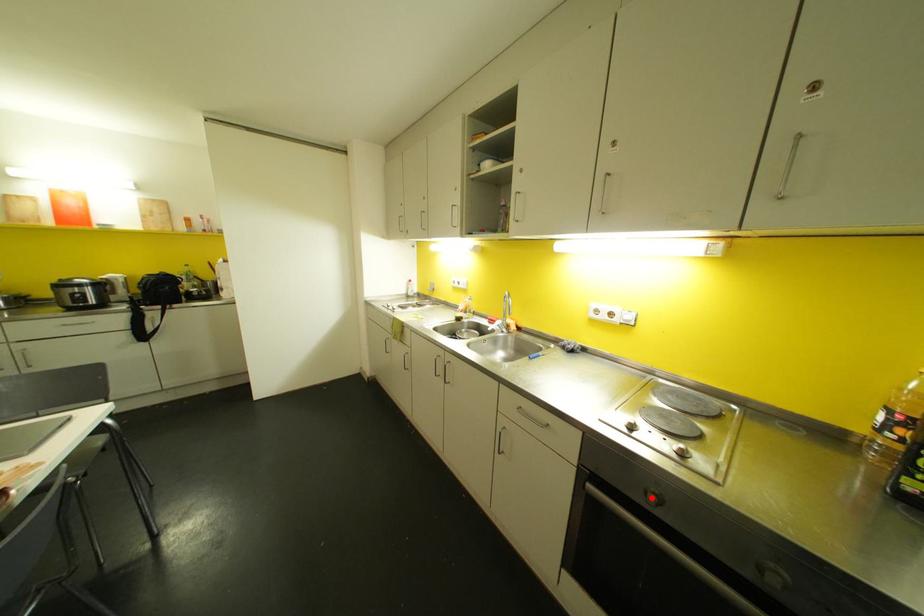
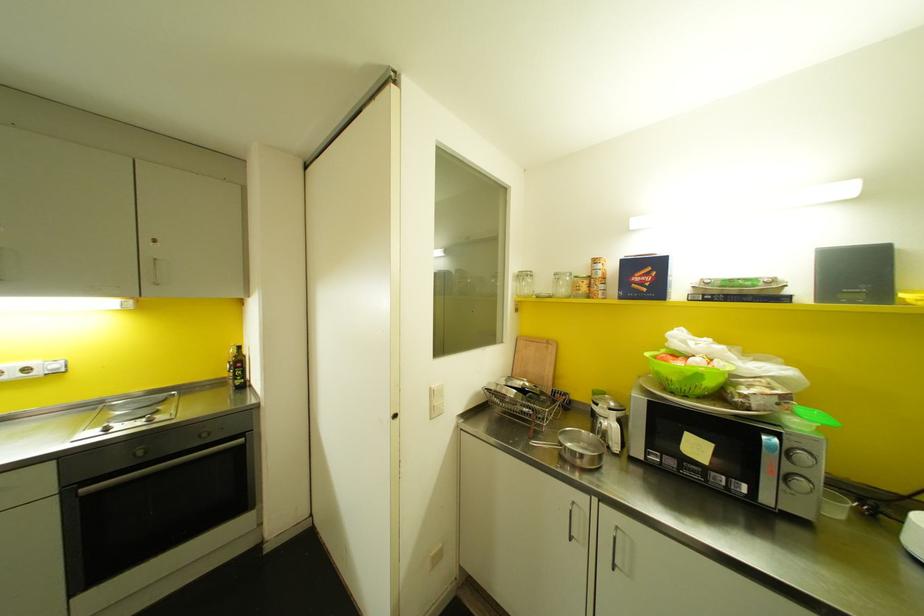
The point at the highlighted location is marked in the first image. Where is the corresponding point in the second image?

(140, 451)